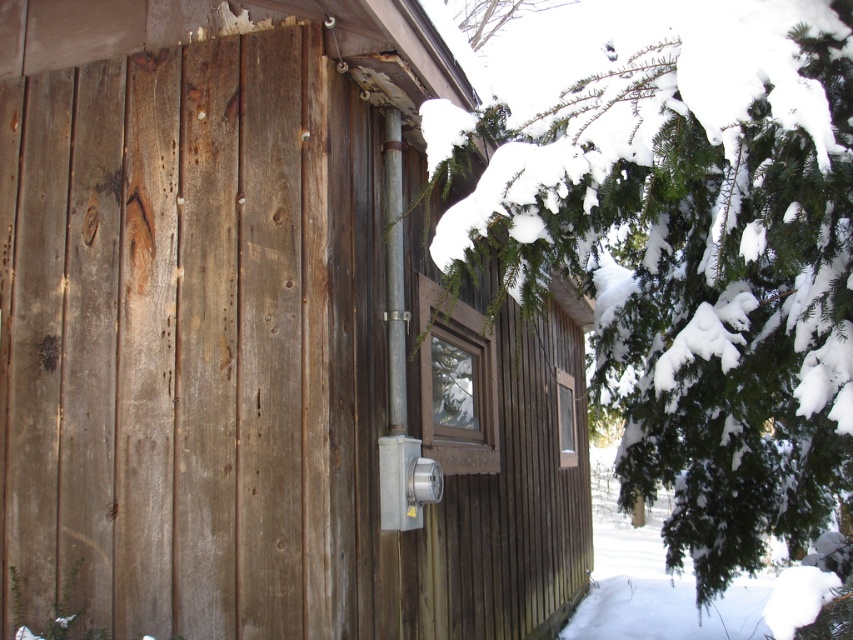
Is weathered wood cabin at center to the left of green textured pine tree at upper right from the viewer's perspective?

Correct, you'll find weathered wood cabin at center to the left of green textured pine tree at upper right.

Does weathered wood cabin at center lie in front of green textured pine tree at upper right?

Yes.

Is point (137, 476) positioned behind point (740, 124)?

Yes.

Locate an element on the screen. The image size is (853, 640). weathered wood cabin at center is located at coordinates coord(252,339).